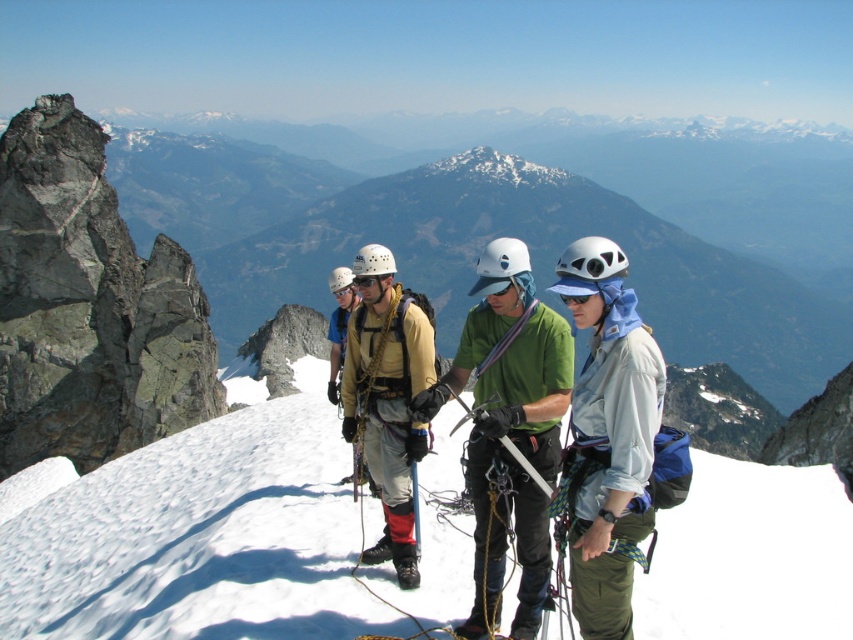
You are a photographer positioned at the base of the mountain observing the climbers. You need to capture a photo where both the green fabric shirt at center and the light blue fabric jacket at center are clearly visible. Based on their positions, which clothing item will appear larger in the photo?

The green fabric shirt at center will appear larger in the photo because it is taller than the light blue fabric jacket at center.

You are a photographer taking a picture of the green fabric shirt at center and the blue matte sunglasses at center. Which object should you zoom in on to make them appear the same size in the photo?

The green fabric shirt at center is bigger than the blue matte sunglasses at center, so you should zoom in on the green fabric shirt at center to make them appear the same size in the photo.

You are a mountaineer preparing to climb a steep section of the mountain. You have two options for clothing to wear for better mobility and visibility. The green fabric shirt at center and the light blue fabric jacket at center are both available. Considering their sizes, which clothing item might be more suitable for the climb?

The green fabric shirt at center has a larger width than the light blue fabric jacket at center, so it might be more suitable for the climb as wider clothing can allow for better mobility during the ascent.